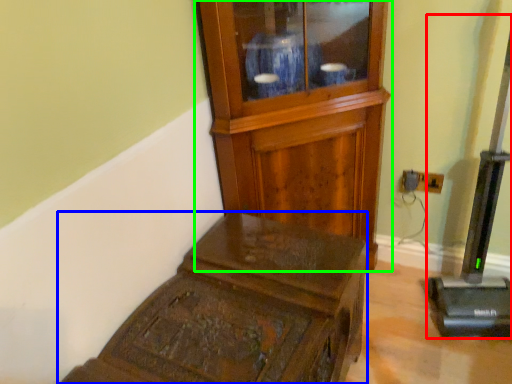
Question: Which object is positioned closest to equipment (highlighted by a red box)? Select from furniture (highlighted by a blue box) and side cabinet (highlighted by a green box).

Choices:
 (A) furniture
 (B) side cabinet

Answer: (B)